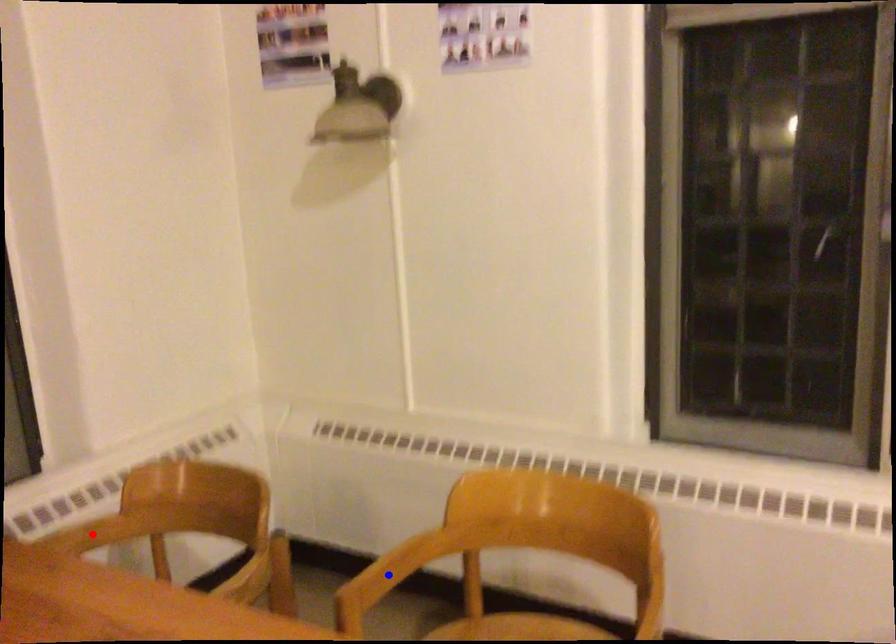
Question: Which of the two points in the image is closer to the camera?

Choices:
 (A) Blue point is closer.
 (B) Red point is closer.

Answer: (A)